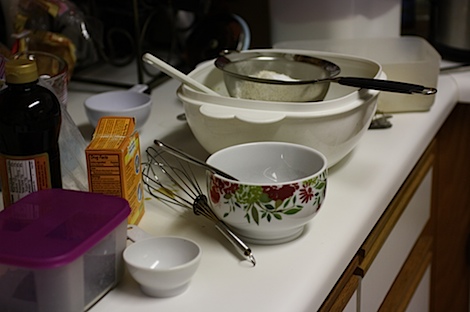
What are the coordinates of `flower designed bowl` in the screenshot? It's located at (296, 211).